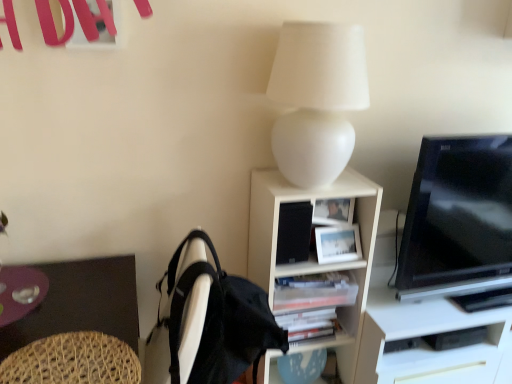
Question: Is black glossy tv at right turned away from woven wood swivel chair at lower left?

Choices:
 (A) yes
 (B) no

Answer: (B)

Question: Is black glossy tv at right not near woven wood swivel chair at lower left?

Choices:
 (A) yes
 (B) no

Answer: (A)

Question: Is black glossy tv at right at the left side of woven wood swivel chair at lower left?

Choices:
 (A) yes
 (B) no

Answer: (B)

Question: Is black glossy tv at right shorter than woven wood swivel chair at lower left?

Choices:
 (A) yes
 (B) no

Answer: (B)

Question: Is black glossy tv at right with woven wood swivel chair at lower left?

Choices:
 (A) no
 (B) yes

Answer: (A)

Question: Is point (373, 225) closer or farther from the camera than point (458, 206)?

Choices:
 (A) closer
 (B) farther

Answer: (B)

Question: From the image's perspective, is white matte shelf at center located above or below black glossy tv at right?

Choices:
 (A) above
 (B) below

Answer: (B)

Question: Is white matte shelf at center taller or shorter than black glossy tv at right?

Choices:
 (A) short
 (B) tall

Answer: (B)

Question: In terms of width, does white matte shelf at center look wider or thinner when compared to black glossy tv at right?

Choices:
 (A) thin
 (B) wide

Answer: (B)

Question: In terms of width, does white matte shelf at center look wider or thinner when compared to black matte speaker at center?

Choices:
 (A) thin
 (B) wide

Answer: (B)

Question: From a real-world perspective, is white matte shelf at center physically located above or below black matte speaker at center?

Choices:
 (A) below
 (B) above

Answer: (A)

Question: Choose the correct answer: Is white matte shelf at center inside black matte speaker at center or outside it?

Choices:
 (A) outside
 (B) inside

Answer: (A)

Question: From the image's perspective, is white matte shelf at center positioned above or below black matte speaker at center?

Choices:
 (A) below
 (B) above

Answer: (A)

Question: In the image, is woven wood swivel chair at lower left on the left side or the right side of transparent glass plate at lower left?

Choices:
 (A) right
 (B) left

Answer: (A)

Question: Is woven wood swivel chair at lower left spatially inside transparent glass plate at lower left, or outside of it?

Choices:
 (A) inside
 (B) outside

Answer: (B)